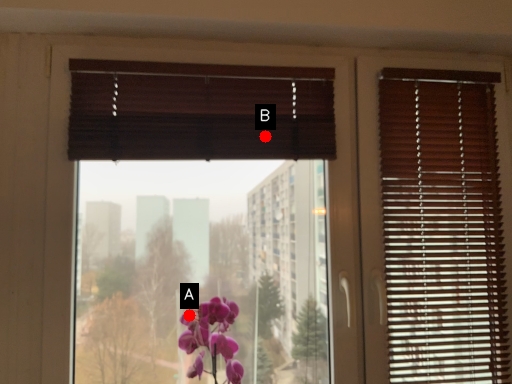
Question: Two points are circled on the image, labeled by A and B beside each circle. Which point is farther from the camera taking this photo?

Choices:
 (A) A is further
 (B) B is further

Answer: (B)